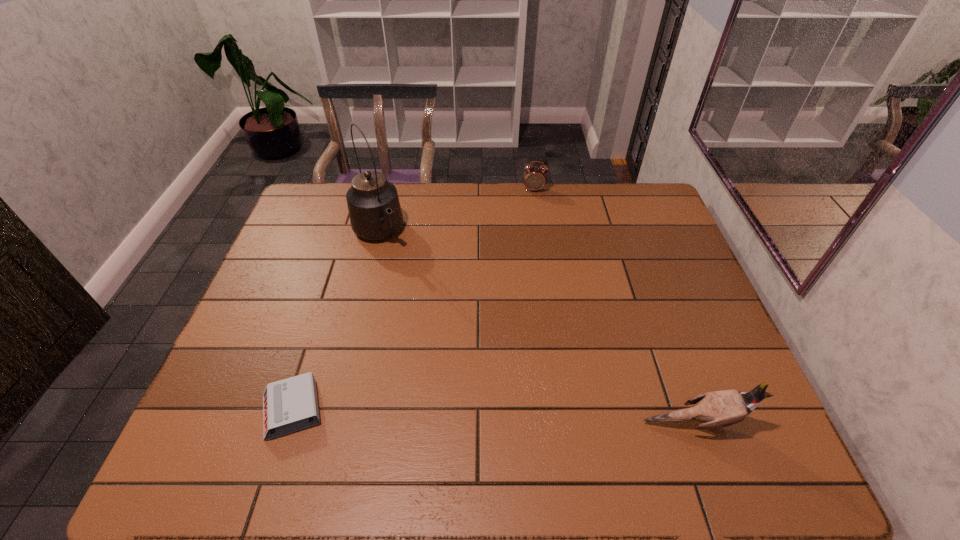
I want to click on the shortest object, so click(289, 405).

Identify the location of the left alarm clock. Image resolution: width=960 pixels, height=540 pixels. (289, 405).

At what (x,y) coordinates should I click in order to perform the action: click on the third shortest object. Please return your answer as a coordinate pair (x, y). The width and height of the screenshot is (960, 540). Looking at the image, I should click on (717, 409).

In order to click on the rightmost object in this screenshot , I will do `click(717, 409)`.

Identify the location of the third object from left to right. (535, 178).

Image resolution: width=960 pixels, height=540 pixels. What are the coordinates of `the farthest object` in the screenshot? It's located at (535, 178).

Identify the location of kettle. (375, 213).

You are a GUI agent. You are given a task and a screenshot of the screen. Output one action in this format:
    pyautogui.click(x=<x>, y=<y>)
    Task: Click on the tallest object
    This screenshot has width=960, height=540.
    Given the screenshot: What is the action you would take?
    pyautogui.click(x=375, y=213)

Identify the location of vacant space located 0.350m on the back of the left alarm clock. This screenshot has width=960, height=540. (334, 275).

At what (x,y) coordinates should I click in order to perform the action: click on free spot located on the face of the taller alarm clock. Please return your answer as a coordinate pair (x, y). Looking at the image, I should click on (535, 230).